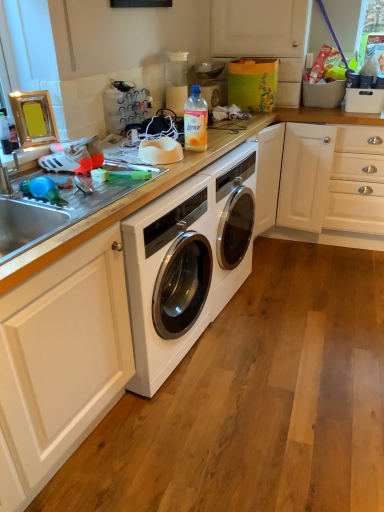
Question: Does translucent plastic bottle at center have a greater width compared to white glossy countertop at center?

Choices:
 (A) no
 (B) yes

Answer: (A)

Question: Is translucent plastic bottle at center thinner than white glossy countertop at center?

Choices:
 (A) no
 (B) yes

Answer: (B)

Question: Is translucent plastic bottle at center further to camera compared to white glossy countertop at center?

Choices:
 (A) yes
 (B) no

Answer: (B)

Question: Can you confirm if translucent plastic bottle at center is smaller than white glossy countertop at center?

Choices:
 (A) no
 (B) yes

Answer: (B)

Question: Does translucent plastic bottle at center come in front of white glossy countertop at center?

Choices:
 (A) no
 (B) yes

Answer: (B)

Question: Does translucent plastic bottle at center appear on the right side of white glossy countertop at center?

Choices:
 (A) no
 (B) yes

Answer: (B)

Question: Can you confirm if matte white cabinet at upper right is shorter than white glossy countertop at center?

Choices:
 (A) yes
 (B) no

Answer: (A)

Question: Is the depth of matte white cabinet at upper right greater than that of white glossy countertop at center?

Choices:
 (A) yes
 (B) no

Answer: (A)

Question: Is matte white cabinet at upper right positioned beyond the bounds of white glossy countertop at center?

Choices:
 (A) no
 (B) yes

Answer: (B)

Question: Does matte white cabinet at upper right have a smaller size compared to white glossy countertop at center?

Choices:
 (A) no
 (B) yes

Answer: (B)

Question: From a real-world perspective, is matte white cabinet at upper right positioned over white glossy countertop at center based on gravity?

Choices:
 (A) no
 (B) yes

Answer: (B)

Question: From the image's perspective, is matte white cabinet at upper right under white glossy countertop at center?

Choices:
 (A) yes
 (B) no

Answer: (B)

Question: Does white glossy countertop at center turn towards matte white cabinet at upper right?

Choices:
 (A) yes
 (B) no

Answer: (B)